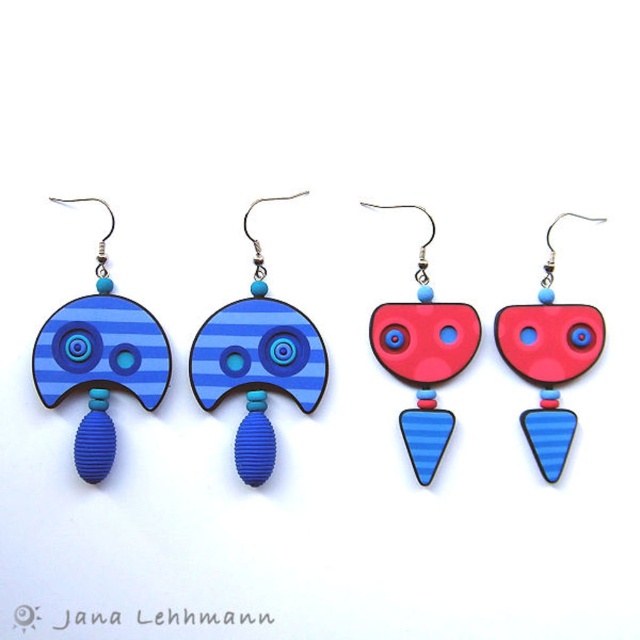
You are looking at the earrings displayed against a white background. The image has two points labeled as point [35,348] and point [564,412]. Which point is closer to you?

Point [35,348] is in front of point [564,412], so it is closer to you.

You are an artisan creating a pair of earrings. You have two pieces of wood available, the blue striped wood at center and the matte blue wood earring at center. If you want to ensure the earring has a balanced look, which piece should you place closer to the center of the earring design?

The blue striped wood at center has a larger width than the matte blue wood earring at center. To achieve a balanced look, the wider blue striped wood at center should be placed closer to the center of the earring design to counterbalance its size.

You are a jeweler who needs to package these two earrings. The packaging box has a width of 5 inches. Can you fit both the matte blue wood earring at center and the matte red plastic heart at center into the box without overlapping?

The distance between the matte blue wood earring at center and the matte red plastic heart at center is 4.56 inches. Since the box is 5 inches wide, there is enough space to place both items side by side without overlapping.